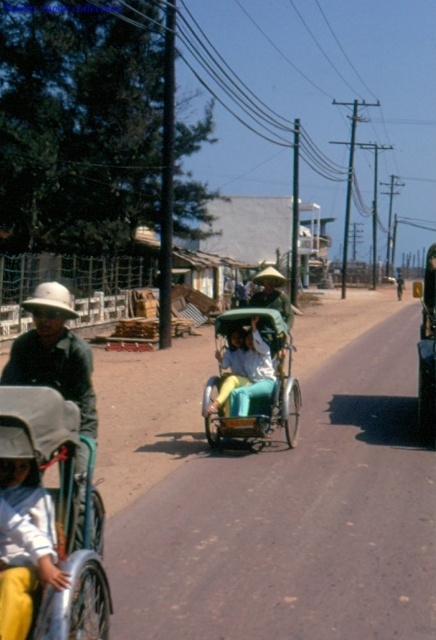
Who is lower down, green fabric rickshaw at center or matte white coach at left?

Result: matte white coach at left is below.

The height and width of the screenshot is (640, 436). What are the coordinates of `green fabric rickshaw at center` in the screenshot? It's located at coord(252,378).

This screenshot has height=640, width=436. What are the coordinates of `green fabric rickshaw at center` in the screenshot? It's located at (252, 378).

Is green fabric rickshaw at center taller than light blue fabric at lower left?

Correct, green fabric rickshaw at center is much taller as light blue fabric at lower left.

Image resolution: width=436 pixels, height=640 pixels. In order to click on green fabric rickshaw at center in this screenshot , I will do `click(252, 378)`.

At what (x,y) coordinates should I click in order to perform the action: click on green fabric rickshaw at center. Please return your answer as a coordinate pair (x, y). This screenshot has width=436, height=640. Looking at the image, I should click on (252, 378).

Is matte white coach at left smaller than light blue fabric at lower left?

Yes, matte white coach at left is smaller than light blue fabric at lower left.

Can you confirm if matte white coach at left is shorter than light blue fabric at lower left?

Indeed, matte white coach at left has a lesser height compared to light blue fabric at lower left.

Is point (70, 353) positioned after point (10, 536)?

That is True.

This screenshot has height=640, width=436. Identify the location of matte white coach at left. (54, 353).